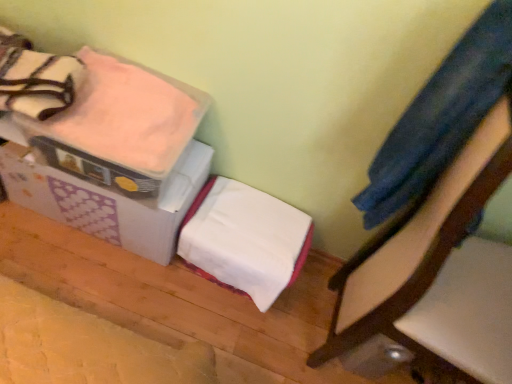
Locate an element on the screen. This screenshot has height=384, width=512. denim fabric pants at upper right is located at coordinates (441, 116).

The width and height of the screenshot is (512, 384). Describe the element at coordinates (439, 273) in the screenshot. I see `wooden chair at right` at that location.

What do you see at coordinates (108, 201) in the screenshot? The width and height of the screenshot is (512, 384). I see `white cardboard box at upper left` at bounding box center [108, 201].

In order to face white cardboard box at upper left, should I rotate leftwards or rightwards?

Turn left approximately 19.684 degrees to face it.

At what (x,y) coordinates should I click in order to perform the action: click on white soft blanket at center, marked as the first blanket in a bottom-to-top arrangement. Please return your answer as a coordinate pair (x, y). This screenshot has height=384, width=512. Looking at the image, I should click on (246, 240).

Between denim fabric pants at upper right and white cardboard box at upper left, which one has more height?

denim fabric pants at upper right is taller.

Can you tell me how much denim fabric pants at upper right and white cardboard box at upper left differ in facing direction?

The angle between the facing direction of denim fabric pants at upper right and the facing direction of white cardboard box at upper left is 85.7 degrees.

Which object is positioned more to the right, denim fabric pants at upper right or white cardboard box at upper left?

denim fabric pants at upper right is more to the right.

Is denim fabric pants at upper right surrounding white cardboard box at upper left?

No, white cardboard box at upper left is not surrounded by denim fabric pants at upper right.

Looking at this image, is pink soft fabric blanket at upper left, the second blanket when ordered from bottom to top, wider than denim fabric pants at upper right?

Correct, the width of pink soft fabric blanket at upper left, the second blanket when ordered from bottom to top, exceeds that of denim fabric pants at upper right.

Relative to denim fabric pants at upper right, is pink soft fabric blanket at upper left, the second blanket when ordered from bottom to top, in front or behind?

In the image, pink soft fabric blanket at upper left, the second blanket when ordered from bottom to top, appears behind denim fabric pants at upper right.

Find the location of a particular element. The height and width of the screenshot is (384, 512). clothing on the right of pink soft fabric blanket at upper left, the 1th blanket in the top-to-bottom sequence is located at coordinates (441, 116).

Is pink soft fabric blanket at upper left, the second blanket when ordered from bottom to top, to the right of denim fabric pants at upper right from the viewer's perspective?

Incorrect, pink soft fabric blanket at upper left, the second blanket when ordered from bottom to top, is not on the right side of denim fabric pants at upper right.

Between wooden chair at right and white soft blanket at center, the 2th blanket viewed from the top, which one has larger width?

With larger width is wooden chair at right.

Measure the distance from wooden chair at right to white soft blanket at center, the 2th blanket viewed from the top.

A distance of 14.77 inches exists between wooden chair at right and white soft blanket at center, the 2th blanket viewed from the top.

Considering the relative sizes of wooden chair at right and white soft blanket at center, marked as the first blanket in a bottom-to-top arrangement, in the image provided, is wooden chair at right bigger than white soft blanket at center, marked as the first blanket in a bottom-to-top arrangement,?

Correct, wooden chair at right is larger in size than white soft blanket at center, marked as the first blanket in a bottom-to-top arrangement.

Who is shorter, wooden chair at right or white soft blanket at center, the 2th blanket viewed from the top?

white soft blanket at center, the 2th blanket viewed from the top, is shorter.

From a real-world perspective, is wooden chair at right beneath denim fabric pants at upper right?

Correct, in the physical world, wooden chair at right is lower than denim fabric pants at upper right.

Is wooden chair at right positioned with its back to denim fabric pants at upper right?

Yes, wooden chair at right is positioned with its back facing denim fabric pants at upper right.

Is the depth of wooden chair at right less than that of denim fabric pants at upper right?

Yes, wooden chair at right is closer to the camera.

Based on the photo, is white soft blanket at center, the 2th blanket viewed from the top, positioned behind denim fabric pants at upper right?

Yes, white soft blanket at center, the 2th blanket viewed from the top, is further from the camera.

From a real-world perspective, who is located higher, white soft blanket at center, the 2th blanket viewed from the top, or denim fabric pants at upper right?

denim fabric pants at upper right is physically above.

Looking at this image, in terms of width, does white soft blanket at center, marked as the first blanket in a bottom-to-top arrangement, look wider or thinner when compared to denim fabric pants at upper right?

In the image, white soft blanket at center, marked as the first blanket in a bottom-to-top arrangement, appears to be more narrow than denim fabric pants at upper right.

Can you tell me how much white soft blanket at center, marked as the first blanket in a bottom-to-top arrangement, and wooden chair at right differ in facing direction?

They differ by 85.7 degrees in their facing directions.

Based on their sizes in the image, would you say white soft blanket at center, the 2th blanket viewed from the top, is bigger or smaller than wooden chair at right?

Considering their sizes, white soft blanket at center, the 2th blanket viewed from the top, takes up less space than wooden chair at right.

Who is shorter, white soft blanket at center, marked as the first blanket in a bottom-to-top arrangement, or wooden chair at right?

white soft blanket at center, marked as the first blanket in a bottom-to-top arrangement.

Considering the relative positions of white soft blanket at center, marked as the first blanket in a bottom-to-top arrangement, and wooden chair at right in the image provided, is white soft blanket at center, marked as the first blanket in a bottom-to-top arrangement, to the left of wooden chair at right from the viewer's perspective?

Indeed, white soft blanket at center, marked as the first blanket in a bottom-to-top arrangement, is positioned on the left side of wooden chair at right.

Considering the sizes of objects denim fabric pants at upper right and pink soft fabric blanket at upper left, the second blanket when ordered from bottom to top, in the image provided, who is taller, denim fabric pants at upper right or pink soft fabric blanket at upper left, the second blanket when ordered from bottom to top,?

denim fabric pants at upper right.

Is denim fabric pants at upper right far from pink soft fabric blanket at upper left, the second blanket when ordered from bottom to top?

denim fabric pants at upper right is near pink soft fabric blanket at upper left, the second blanket when ordered from bottom to top, not far away.

From the image's perspective, between denim fabric pants at upper right and pink soft fabric blanket at upper left, the 1th blanket in the top-to-bottom sequence, who is located below?

denim fabric pants at upper right is shown below in the image.

Image resolution: width=512 pixels, height=384 pixels. Identify the location of clothing above the white cardboard box at upper left (from a real-world perspective). pos(441,116).

At what (x,y) coordinates should I click in order to perform the action: click on clothing on the right of pink soft fabric blanket at upper left, the second blanket when ordered from bottom to top. Please return your answer as a coordinate pair (x, y). The width and height of the screenshot is (512, 384). Looking at the image, I should click on (441, 116).

Estimate the real-world distances between objects in this image. Which object is further from white cardboard box at upper left, pink soft fabric blanket at upper left, the second blanket when ordered from bottom to top, or denim fabric pants at upper right?

The object further to white cardboard box at upper left is denim fabric pants at upper right.

Looking at the image, which one is located closer to white cardboard box at upper left, white soft blanket at center, marked as the first blanket in a bottom-to-top arrangement, or denim fabric pants at upper right?

Among the two, white soft blanket at center, marked as the first blanket in a bottom-to-top arrangement, is located nearer to white cardboard box at upper left.

When comparing their distances from denim fabric pants at upper right, does white soft blanket at center, the 2th blanket viewed from the top, or pink soft fabric blanket at upper left, the 1th blanket in the top-to-bottom sequence, seem closer?

Among the two, white soft blanket at center, the 2th blanket viewed from the top, is located nearer to denim fabric pants at upper right.

Which object lies further to the anchor point pink soft fabric blanket at upper left, the second blanket when ordered from bottom to top, white cardboard box at upper left or white soft blanket at center, marked as the first blanket in a bottom-to-top arrangement?

white soft blanket at center, marked as the first blanket in a bottom-to-top arrangement, is positioned further to the anchor pink soft fabric blanket at upper left, the second blanket when ordered from bottom to top.

From the image, which object appears to be farther from pink soft fabric blanket at upper left, the second blanket when ordered from bottom to top, denim fabric pants at upper right or white cardboard box at upper left?

The object further to pink soft fabric blanket at upper left, the second blanket when ordered from bottom to top, is denim fabric pants at upper right.

Estimate the real-world distances between objects in this image. Which object is closer to wooden chair at right, white cardboard box at upper left or white soft blanket at center, marked as the first blanket in a bottom-to-top arrangement?

white soft blanket at center, marked as the first blanket in a bottom-to-top arrangement.

Considering their positions, is white soft blanket at center, the 2th blanket viewed from the top, positioned further to white cardboard box at upper left than wooden chair at right?

wooden chair at right.

Consider the image. Looking at the image, which one is located further to white soft blanket at center, marked as the first blanket in a bottom-to-top arrangement, wooden chair at right or white cardboard box at upper left?

wooden chair at right is positioned further to the anchor white soft blanket at center, marked as the first blanket in a bottom-to-top arrangement.

Locate an element on the screen. The height and width of the screenshot is (384, 512). clothing located between pink soft fabric blanket at upper left, the second blanket when ordered from bottom to top, and wooden chair at right in the left-right direction is located at coordinates (441, 116).

At what (x,y) coordinates should I click in order to perform the action: click on blanket located between pink soft fabric blanket at upper left, the 1th blanket in the top-to-bottom sequence, and denim fabric pants at upper right in the left-right direction. Please return your answer as a coordinate pair (x, y). This screenshot has width=512, height=384. Looking at the image, I should click on (246, 240).

This screenshot has width=512, height=384. Find the location of `blanket located between pink soft fabric blanket at upper left, the second blanket when ordered from bottom to top, and wooden chair at right in the left-right direction`. blanket located between pink soft fabric blanket at upper left, the second blanket when ordered from bottom to top, and wooden chair at right in the left-right direction is located at coordinates (246, 240).

Identify the location of clothing between white cardboard box at upper left and wooden chair at right. The width and height of the screenshot is (512, 384). (441, 116).